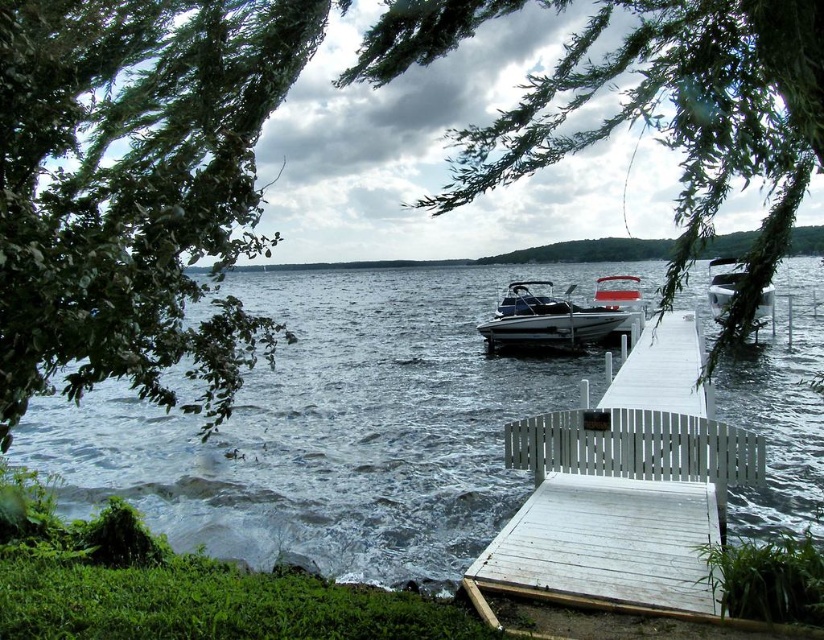
You are standing at the edge of the lake and want to take a photo of the green leafy tree at center without any obstructions. Given that your camera has a zoom lens, should you move closer to the tree or zoom in to avoid the branches obscuring the view?

The green leafy tree at center is located at point (680, 122), so you should zoom in to avoid the branches obscuring the view without moving closer.

You are a photographer planning to take a photo of the green leafy tree at center and the metallic blue boat at center from the dock. Considering their widths, which object will occupy more space in your photo?

The green leafy tree at center has a greater width than the metallic blue boat at center, so it will occupy more space in the photo.

You are standing on the wooden dock and want to know which object in the scene is wider. Based on the dark blue water at center and the green leafy tree at center, which one has a greater width?

The dark blue water at center has a greater width than the green leafy tree at center.